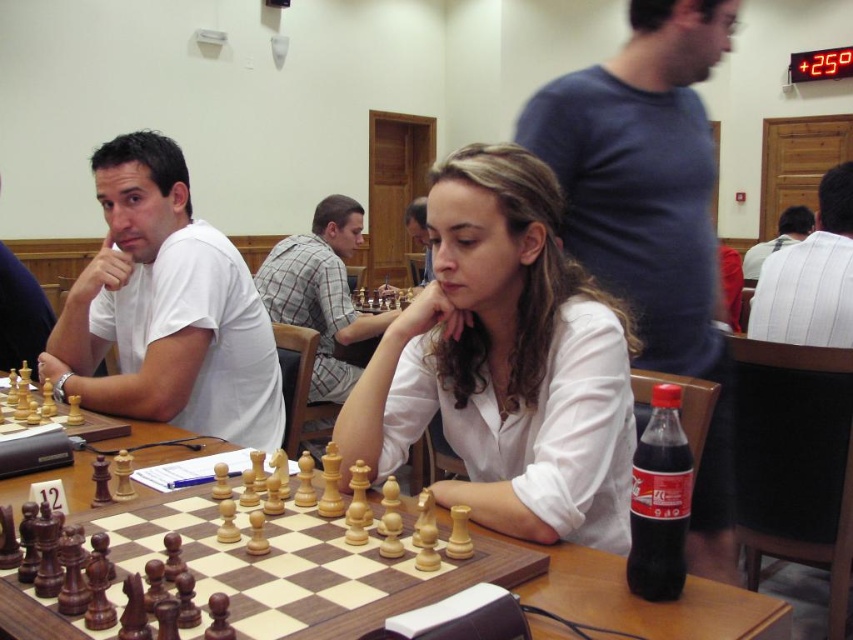
Question: Is plaid fabric shirt at center in front of white shirt at center?

Choices:
 (A) no
 (B) yes

Answer: (B)

Question: Among these points, which one is nearest to the camera?

Choices:
 (A) (334, 324)
 (B) (746, 589)

Answer: (B)

Question: Which of the following is the closest to the observer?

Choices:
 (A) (843, 273)
 (B) (567, 456)

Answer: (B)

Question: Among these objects, which one is farthest from the camera?

Choices:
 (A) white matte shirt at left
 (B) white striped shirt at upper right
 (C) white shirt at center
 (D) wooden chessboard at center

Answer: (C)

Question: Is white matte shirt at left positioned at the back of plaid fabric shirt at center?

Choices:
 (A) no
 (B) yes

Answer: (A)

Question: From the image, what is the correct spatial relationship of white matte shirt at left in relation to wooden chessboard at center?

Choices:
 (A) right
 (B) left

Answer: (B)